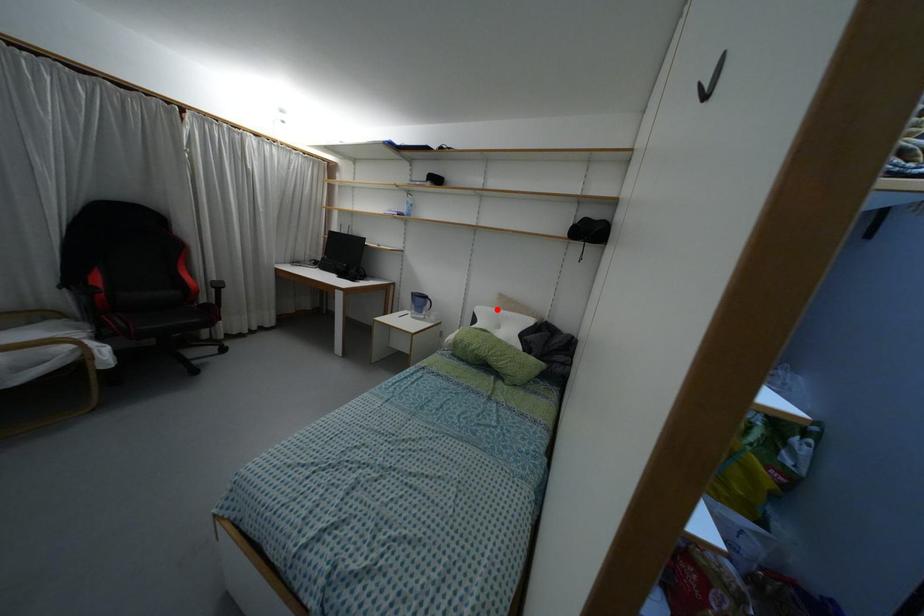
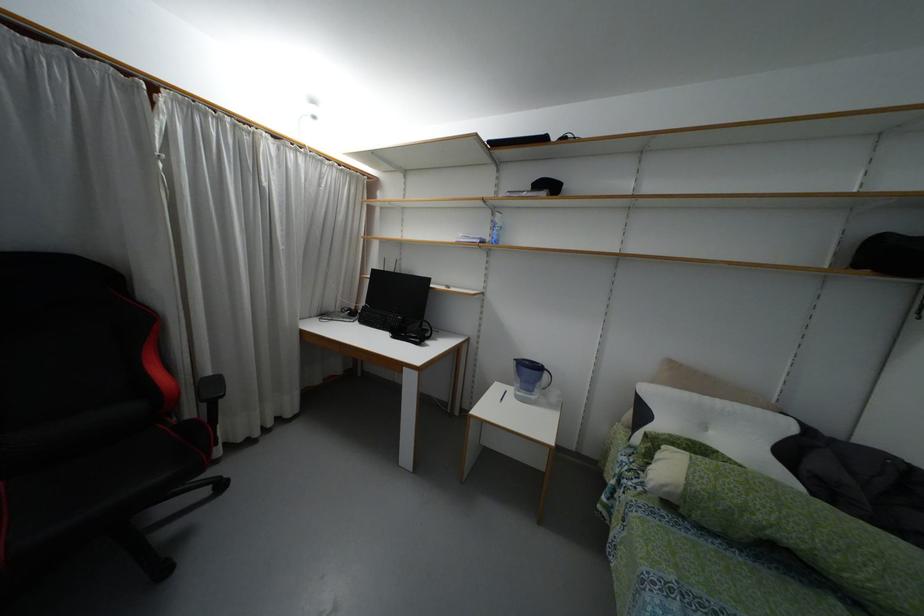
Where in the second image is the point corresponding to the highlighted location from the first image?

(695, 395)